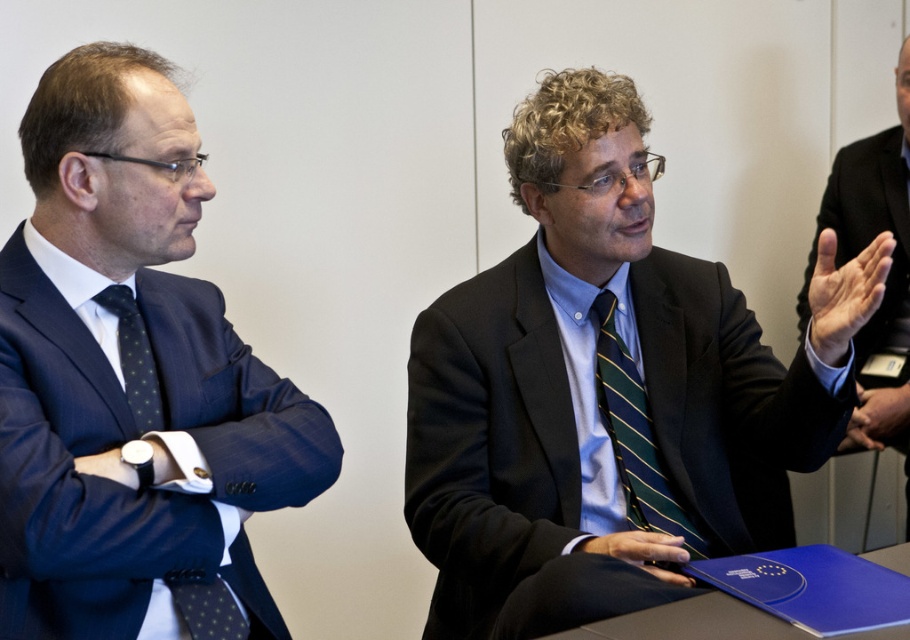
You are organizing a charity event and need to decide which item to place first in a donation box. The items are the matte blue suit at left and the green striped tie at center. Based on their sizes, which item should you place first?

The matte blue suit at left is bigger than the green striped tie at center, so you should place the smaller green striped tie at center first to ensure it fits properly over the larger item.

You are an event planner observing a meeting between two professionals. You notice the matte black suit at center and the dark blue dotted tie at left. Which object is closer to the viewer?

The dark blue dotted tie at left is behind the matte black suit at center, so the matte black suit at center is closer to the viewer.